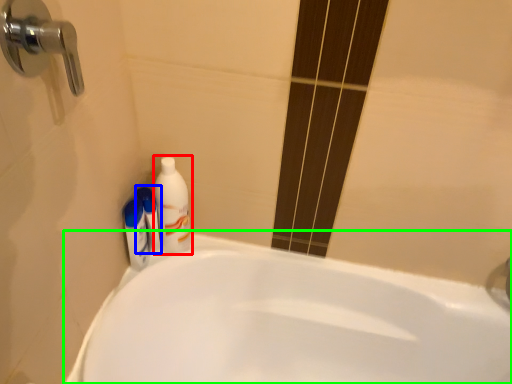
Question: Which object is positioned closest to cleaning product (highlighted by a red box)? Select from mouthwash (highlighted by a blue box) and bathtub (highlighted by a green box).

Choices:
 (A) mouthwash
 (B) bathtub

Answer: (A)